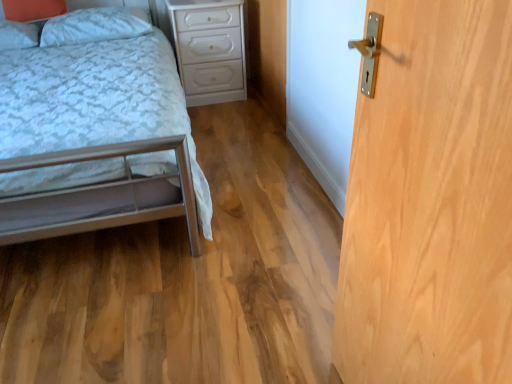
Question: From their relative heights in the image, would you say light wood/texture door at right is taller or shorter than matte white pillow at upper left, placed as the 1th pillow when sorted from left to right?

Choices:
 (A) tall
 (B) short

Answer: (A)

Question: Considering the positions of point (338, 301) and point (7, 38), is point (338, 301) closer or farther from the camera than point (7, 38)?

Choices:
 (A) closer
 (B) farther

Answer: (A)

Question: Which object is positioned farthest from the metallic silver bed at lower left?

Choices:
 (A) white soft pillow at upper left, the 2th pillow positioned from the left
 (B) matte white pillow at upper left, placed as the 1th pillow when sorted from left to right
 (C) white glossy nightstand at center
 (D) light wood/texture door at right

Answer: (D)

Question: Which is nearer to the matte white pillow at upper left, placed as the 1th pillow when sorted from left to right?

Choices:
 (A) metallic silver bed at lower left
 (B) white soft pillow at upper left, which is the 1th pillow from right to left
 (C) white glossy nightstand at center
 (D) light wood/texture door at right

Answer: (B)